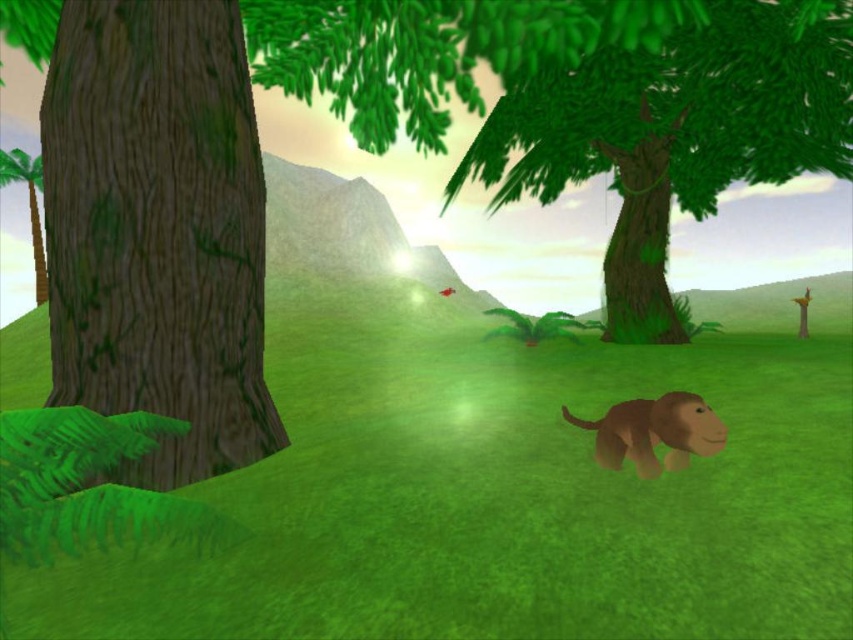
Does green grass at center come behind brown textured tree at left?

No.

From the picture: Who is higher up, green grass at center or brown textured tree at left?

brown textured tree at left is higher up.

Is point (202, 605) closer to viewer compared to point (187, 49)?

Yes, it is.

Locate an element on the screen. green grass at center is located at coordinates (506, 486).

Is green grass at center bigger than brown matte monkey at center?

Yes, green grass at center is bigger than brown matte monkey at center.

Does green grass at center appear on the right side of brown matte monkey at center?

Indeed, green grass at center is positioned on the right side of brown matte monkey at center.

Is point (775, 358) positioned before point (624, 401)?

No, it is behind (624, 401).

At what (x,y) coordinates should I click in order to perform the action: click on green grass at center. Please return your answer as a coordinate pair (x, y). Looking at the image, I should click on [x=506, y=486].

Does brown textured tree at left appear over green matte tree at upper center?

No.

In the scene shown: Is brown textured tree at left positioned before green matte tree at upper center?

Yes, it is in front of green matte tree at upper center.

Which is in front, point (254, 317) or point (753, 26)?

Point (254, 317) is in front.

You are a GUI agent. You are given a task and a screenshot of the screen. Output one action in this format:
    pyautogui.click(x=<x>, y=<y>)
    Task: Click on the brown textured tree at left
    Image resolution: width=853 pixels, height=640 pixels.
    Given the screenshot: What is the action you would take?
    pyautogui.click(x=157, y=228)